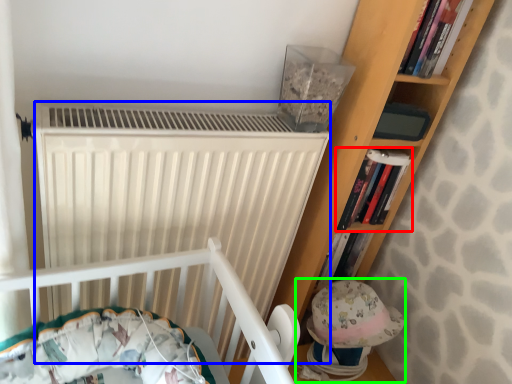
Question: Which object is positioned farthest from book (highlighted by a red box)? Select from radiator (highlighted by a blue box) and toy (highlighted by a green box).

Choices:
 (A) radiator
 (B) toy

Answer: (A)